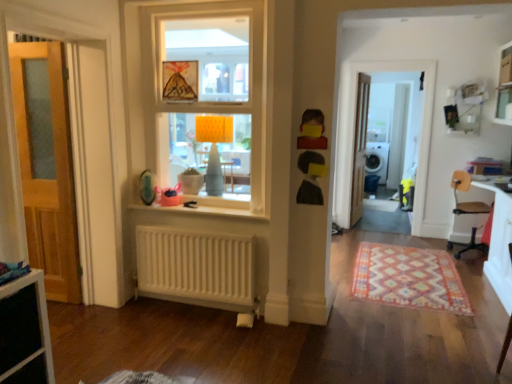
Question: Is yellow matte toy at upper center, which is counted as the first toy, starting from the front, to the left or to the right of white plastic chair at right in the image?

Choices:
 (A) right
 (B) left

Answer: (B)

Question: Do you think yellow matte toy at upper center, marked as the 3th toy in a back-to-front arrangement, is within white plastic chair at right, or outside of it?

Choices:
 (A) outside
 (B) inside

Answer: (A)

Question: Estimate the real-world distances between objects in this image. Which object is farther from the wooden door at left, which appears as the 1th door when viewed from the front?

Choices:
 (A) white plastic chair at right
 (B) orange fabric lampshade at upper center
 (C) multicolored woven rug at lower right
 (D) yellow paper picture frame at upper center
 (E) white glossy dishwasher at right

Answer: (E)

Question: Which of these objects is positioned closest to the white glossy screen door at center, which is counted as the 2th screen door, starting from the left?

Choices:
 (A) white glossy dishwasher at right
 (B) white plastic chair at right
 (C) white glossy window sill at center
 (D) multicolored woven rug at lower right
 (E) white painted wood window at center

Answer: (A)